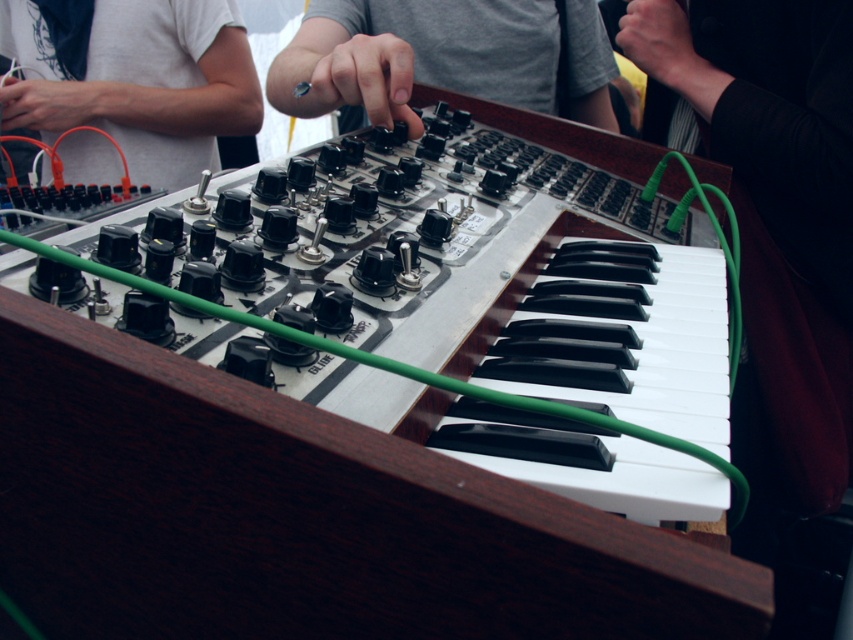
Question: From the image, what is the correct spatial relationship of white matte shirt at upper left in relation to gray matte switch at center?

Choices:
 (A) below
 (B) above

Answer: (B)

Question: Which point is farther to the camera?

Choices:
 (A) (184, 164)
 (B) (486, 48)

Answer: (A)

Question: Which of the following is the closest to the observer?

Choices:
 (A) white matte shirt at upper left
 (B) gray matte switch at center

Answer: (B)

Question: Observing the image, what is the correct spatial positioning of white matte shirt at upper left in reference to gray matte switch at center?

Choices:
 (A) left
 (B) right

Answer: (A)

Question: Can you confirm if white matte shirt at upper left is thinner than gray matte switch at center?

Choices:
 (A) yes
 (B) no

Answer: (A)